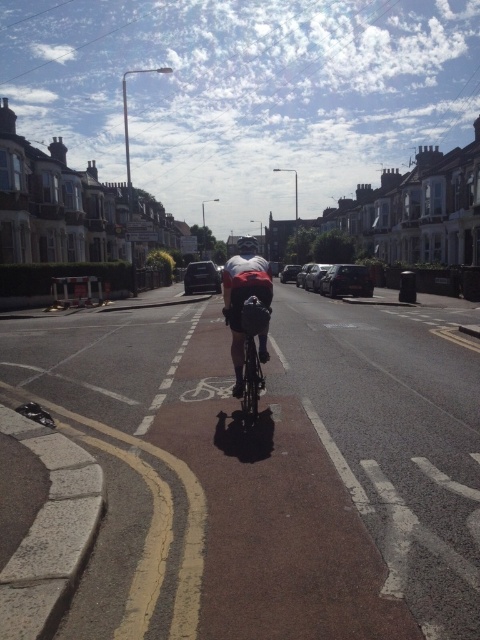
Who is higher up, white fabric cyclist at center or matte black helmet at center?

matte black helmet at center is above.

What do you see at coordinates (243, 296) in the screenshot?
I see `white fabric cyclist at center` at bounding box center [243, 296].

Locate an element on the screen. The image size is (480, 640). white fabric cyclist at center is located at coordinates (243, 296).

Which is more to the left, brown asphalt bike lane at center or matte black helmet at center?

matte black helmet at center is more to the left.

Does point (201, 320) come behind point (244, 252)?

Yes, it is behind point (244, 252).

Does point (360, 428) lie behind point (237, 250)?

No, it is not.

In order to click on brown asphalt bike lane at center in this screenshot , I will do `click(275, 465)`.

Is the position of shiny metallic bicycle at center more distant than that of matte black helmet at center?

No, it is not.

Between shiny metallic bicycle at center and matte black helmet at center, which one has more height?

Standing taller between the two is matte black helmet at center.

Where is `shiny metallic bicycle at center`? The width and height of the screenshot is (480, 640). shiny metallic bicycle at center is located at coordinates (252, 356).